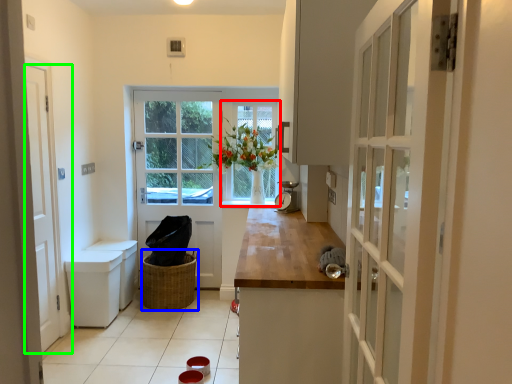
Question: Based on their relative distances, which object is farther from window (highlighted by a red box)? Choose from basket (highlighted by a blue box) and door (highlighted by a green box).

Choices:
 (A) basket
 (B) door

Answer: (B)